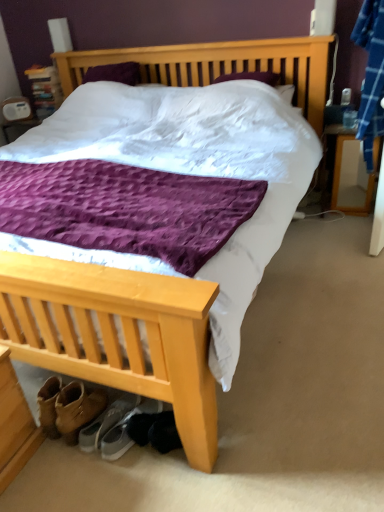
Question: From a real-world perspective, is gray suede sneakers at lower left, positioned as the first footwear in left-to-right order, positioned above or below gray fabric sneakers at lower center, placed as the 2th footwear when sorted from left to right?

Choices:
 (A) above
 (B) below

Answer: (A)

Question: From the image's perspective, relative to gray fabric sneakers at lower center, which is the first footwear in right-to-left order, is gray suede sneakers at lower left, positioned as the first footwear in left-to-right order, above or below?

Choices:
 (A) below
 (B) above

Answer: (B)

Question: Considering the real-world distances, which object is closest to the gray fabric sneakers at lower center, which is the first footwear in right-to-left order?

Choices:
 (A) wooden nightstand at right
 (B) gray suede sneakers at lower left, positioned as the first footwear in left-to-right order

Answer: (B)

Question: Based on their relative distances, which object is nearer to the gray suede sneakers at lower left, the second footwear from the right?

Choices:
 (A) wooden nightstand at right
 (B) gray fabric sneakers at lower center, which is the first footwear in right-to-left order

Answer: (B)